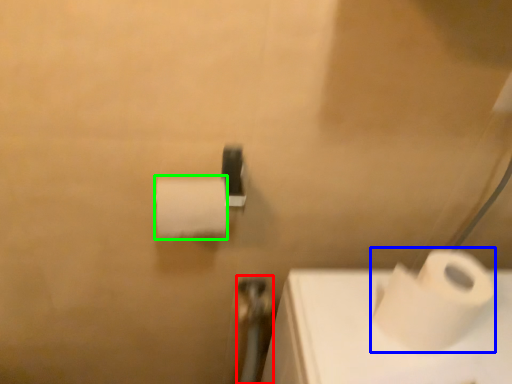
Question: Considering the real-world distances, which object is farthest from shower (highlighted by a red box)? toilet paper (highlighted by a blue box) or toilet paper (highlighted by a green box)?

Choices:
 (A) toilet paper
 (B) toilet paper

Answer: (A)